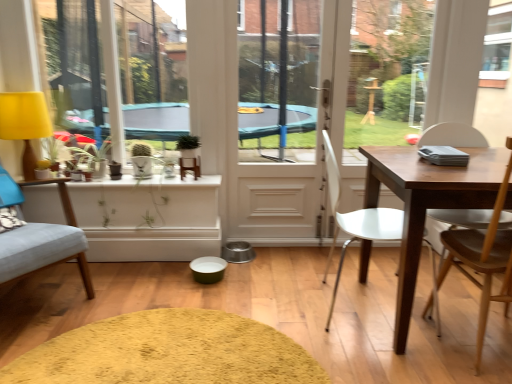
The height and width of the screenshot is (384, 512). In order to click on free region on the left part of white plastic chair at center, the 2th chair when ordered from right to left in this screenshot , I will do `click(274, 284)`.